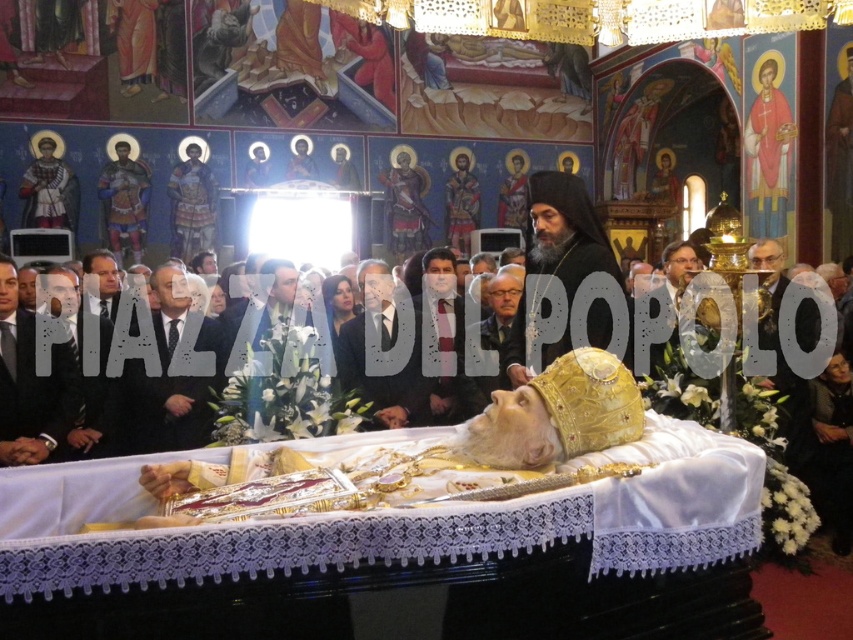
Question: Estimate the real-world distances between objects in this image. Which object is farther from the dark suit at center?

Choices:
 (A) black suit at left
 (B) white textured suit at center
 (C) gold textured crown at center

Answer: (A)

Question: Which of these objects is positioned closest to the dark suit at left?

Choices:
 (A) black suit at left
 (B) gray hair at center
 (C) dark suit at center

Answer: (A)

Question: Can you confirm if gold textured crown at center is positioned to the left of dark suit at center?

Choices:
 (A) no
 (B) yes

Answer: (A)

Question: In this image, where is gold textured crown at center located relative to dark suit at left?

Choices:
 (A) below
 (B) above

Answer: (B)

Question: Does black suit at center have a lesser width compared to gray hair at center?

Choices:
 (A) no
 (B) yes

Answer: (A)

Question: Which object is farther from the camera taking this photo?

Choices:
 (A) gold textured crown at center
 (B) black suit at left

Answer: (B)